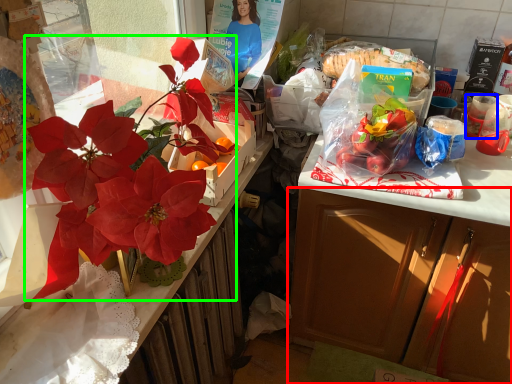
Question: Which object is positioned closest to cabinetry (highlighted by a red box)? Select from coffee cup (highlighted by a blue box) and flower (highlighted by a green box).

Choices:
 (A) coffee cup
 (B) flower

Answer: (A)